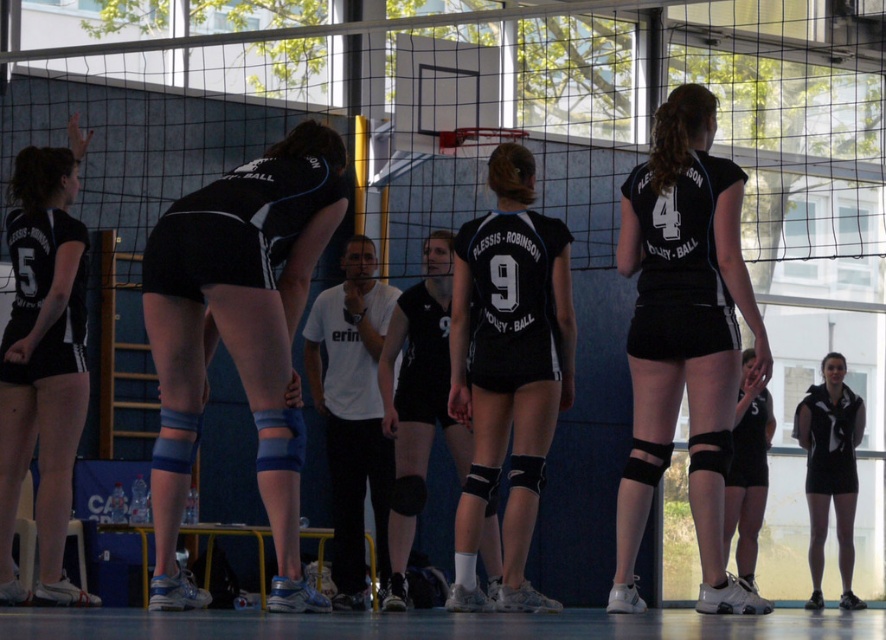
You are a photographer positioned at the back of the gymnasium. You need to take a photo of the black matte volleyball uniform at center and the black matte volleyball at center. Which object should you adjust your camera focus to first if you want to capture both clearly in the same frame?

The black matte volleyball at center should be focused on first since it is positioned to the left of the black matte volleyball uniform at center, allowing the photographer to adjust the focus from left to right to include both in the frame.

You are a photographer standing at the entrance of the gym. You want to take a photo that includes both the volleyball net and the basketball hoop in the background. Given that the black matte volleyball uniform at center is located at point (508,369), can you estimate whether the basketball hoop is to the left or right of the black matte volleyball uniform at center?

The black matte volleyball uniform at center is located at point (508,369). Since the basketball hoop is mentioned in the scene description as being in the background, it is likely positioned behind the net and players. However, without specific spatial coordinates for the hoop, we cannot definitively determine its left or right position relative to the uniform. The question cannot be answered with the provided information.